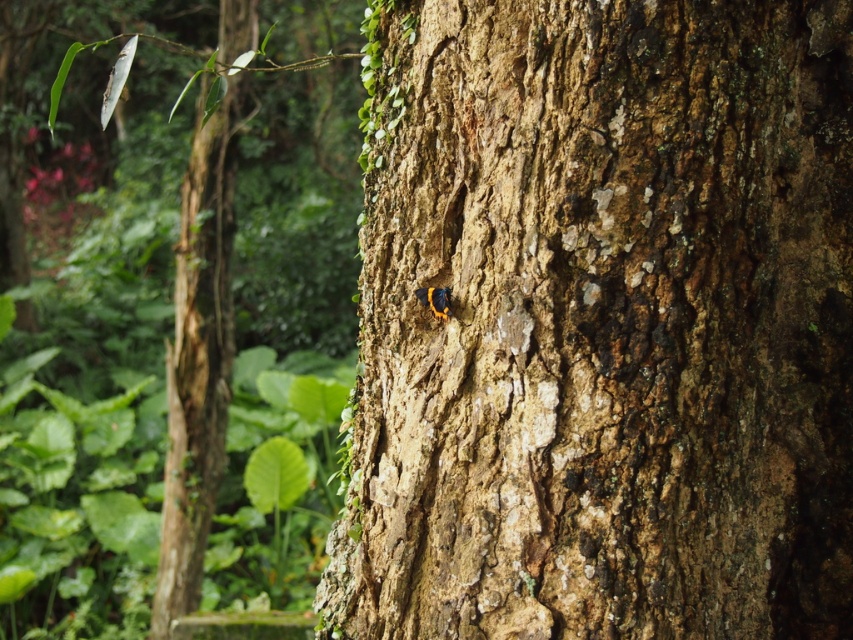
You are a photographer trying to capture the tree trunk and the butterfly in the image. You want to focus on the point closer to the camera. Which point should you focus on between point (718, 163) and point (171, 572)?

Point (718, 163) is closer to the camera than point (171, 572), so you should focus on point (718, 163) to capture the tree trunk and butterfly effectively.

You are a hiker trying to identify two tree trunks in the forest. You see the smooth bark tree trunk at center and the brown rough tree trunk at left. Which one is nearer to you?

Result: The smooth bark tree trunk at center is closer to you than the brown rough tree trunk at left.